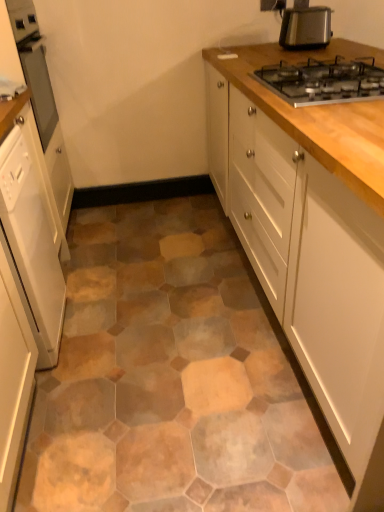
The height and width of the screenshot is (512, 384). Find the location of `free space in front of metallic silver toaster at upper right`. free space in front of metallic silver toaster at upper right is located at coordinates (309, 50).